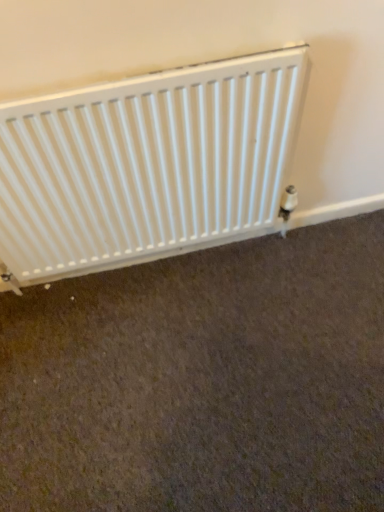
Where is `vacant space underneath white matte radiator at center (from a real-world perspective)`? The width and height of the screenshot is (384, 512). vacant space underneath white matte radiator at center (from a real-world perspective) is located at coordinates (154, 266).